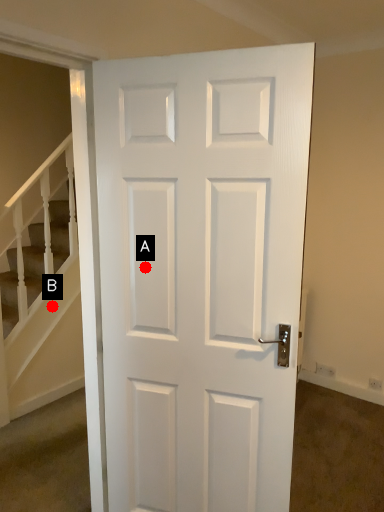
Question: Two points are circled on the image, labeled by A and B beside each circle. Which point appears closest to the camera in this image?

Choices:
 (A) A is closer
 (B) B is closer

Answer: (A)